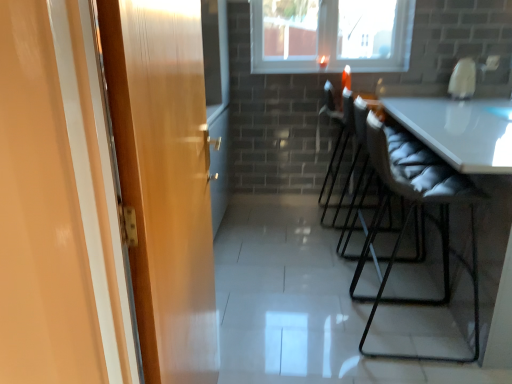
Identify the location of gray quilted cushion at right, the 1th chair positioned from the front. The height and width of the screenshot is (384, 512). (426, 215).

The height and width of the screenshot is (384, 512). Identify the location of black leather chair at center, acting as the third chair starting from the front. (344, 148).

What do you see at coordinates (344, 148) in the screenshot?
I see `black leather chair at center, acting as the 1th chair starting from the back` at bounding box center [344, 148].

You are a GUI agent. You are given a task and a screenshot of the screen. Output one action in this format:
    pyautogui.click(x=<x>, y=<y>)
    Task: Click on the wooden door at left
    The width and height of the screenshot is (512, 384).
    Given the screenshot: What is the action you would take?
    pyautogui.click(x=164, y=180)

Is wooden door at left directly adjacent to transparent glass window at upper center?

No, wooden door at left is not touching transparent glass window at upper center.

Would you say transparent glass window at upper center is part of wooden door at left's contents?

No, transparent glass window at upper center is not inside wooden door at left.

Which point is more distant from viewer, (167, 246) or (317, 32)?

Point (317, 32)

Based on their sizes in the image, would you say wooden door at left is bigger or smaller than black leather chair at center, acting as the third chair starting from the front?

Considering their sizes, wooden door at left takes up less space than black leather chair at center, acting as the third chair starting from the front.

Would you consider wooden door at left to be distant from black leather chair at center, acting as the third chair starting from the front?

wooden door at left is positioned a significant distance from black leather chair at center, acting as the third chair starting from the front.

From the image's perspective, would you say wooden door at left is positioned over black leather chair at center, acting as the third chair starting from the front?

Actually, wooden door at left appears below black leather chair at center, acting as the third chair starting from the front, in the image.

How different are the orientations of wooden door at left and black leather chair at center, acting as the third chair starting from the front, in degrees?

wooden door at left and black leather chair at center, acting as the third chair starting from the front, are facing 5.42 degrees away from each other.

Who is taller, transparent glass window at upper center or gray quilted cushion at right, the 1th chair positioned from the front?

gray quilted cushion at right, the 1th chair positioned from the front, is taller.

Can you confirm if transparent glass window at upper center is smaller than gray quilted cushion at right, which appears as the third chair when viewed from the back?

Correct, transparent glass window at upper center occupies less space than gray quilted cushion at right, which appears as the third chair when viewed from the back.

Is gray quilted cushion at right, the 1th chair positioned from the front, at the back of transparent glass window at upper center?

No, transparent glass window at upper center is not facing away from gray quilted cushion at right, the 1th chair positioned from the front.

Can we say transparent glass window at upper center lies outside gray quilted cushion at right, the 1th chair positioned from the front?

Yes.

From the image's perspective, relative to black leather chair at center, acting as the third chair starting from the front, is gray quilted cushion at right, which appears as the third chair when viewed from the back, above or below?

gray quilted cushion at right, which appears as the third chair when viewed from the back, is below black leather chair at center, acting as the third chair starting from the front.

From a real-world perspective, is gray quilted cushion at right, which appears as the third chair when viewed from the back, above or below black leather chair at center, acting as the third chair starting from the front?

gray quilted cushion at right, which appears as the third chair when viewed from the back, is below black leather chair at center, acting as the third chair starting from the front.

Is gray quilted cushion at right, which appears as the third chair when viewed from the back, taller than black leather chair at center, acting as the third chair starting from the front?

Yes.

Based on their sizes in the image, would you say transparent glass window at upper center is bigger or smaller than matte gray chair at center right, positioned as the 2th chair in back-to-front order?

Clearly, transparent glass window at upper center is smaller in size than matte gray chair at center right, positioned as the 2th chair in back-to-front order.

Looking at this image, how different are the orientations of transparent glass window at upper center and matte gray chair at center right, the second chair when ordered from front to back, in degrees?

The angle between the facing direction of transparent glass window at upper center and the facing direction of matte gray chair at center right, the second chair when ordered from front to back, is 90 degrees.

Does point (355, 64) come behind point (362, 99)?

Yes, it is.

Visually, is transparent glass window at upper center positioned to the left or to the right of matte gray chair at center right, positioned as the 2th chair in back-to-front order?

From the image, it's evident that transparent glass window at upper center is to the left of matte gray chair at center right, positioned as the 2th chair in back-to-front order.

From the image's perspective, is gray quilted cushion at right, which appears as the third chair when viewed from the back, on top of transparent glass window at upper center?

No, from the image's perspective, gray quilted cushion at right, which appears as the third chair when viewed from the back, is not on top of transparent glass window at upper center.

Who is shorter, gray quilted cushion at right, which appears as the third chair when viewed from the back, or transparent glass window at upper center?

transparent glass window at upper center is shorter.

Which is behind, gray quilted cushion at right, which appears as the third chair when viewed from the back, or transparent glass window at upper center?

transparent glass window at upper center is more distant.

Consider the image. Is matte gray chair at center right, positioned as the 2th chair in back-to-front order, closer to camera compared to wooden door at left?

No, matte gray chair at center right, positioned as the 2th chair in back-to-front order, is further to the viewer.

Consider the image. From the image's perspective, is matte gray chair at center right, the second chair when ordered from front to back, located above wooden door at left?

Correct, matte gray chair at center right, the second chair when ordered from front to back, appears higher than wooden door at left in the image.

Measure the distance from matte gray chair at center right, the second chair when ordered from front to back, to wooden door at left.

matte gray chair at center right, the second chair when ordered from front to back, is 5.06 feet away from wooden door at left.

Which of these two, matte gray chair at center right, the second chair when ordered from front to back, or wooden door at left, stands shorter?

matte gray chair at center right, the second chair when ordered from front to back.

This screenshot has width=512, height=384. Find the location of `window that is behind the wooden door at left`. window that is behind the wooden door at left is located at coordinates (330, 35).

Where is `the 1st chair positioned below the wooden door at left (from a real-world perspective)`? the 1st chair positioned below the wooden door at left (from a real-world perspective) is located at coordinates (344, 148).

When comparing their distances from gray quilted cushion at right, the 1th chair positioned from the front, does transparent glass window at upper center or wooden door at left seem further?

transparent glass window at upper center.

Which object lies further to the anchor point matte gray chair at center right, positioned as the 2th chair in back-to-front order, transparent glass window at upper center or wooden door at left?

wooden door at left is positioned further to the anchor matte gray chair at center right, positioned as the 2th chair in back-to-front order.

Considering their positions, is transparent glass window at upper center positioned further to black leather chair at center, acting as the third chair starting from the front, than matte gray chair at center right, the second chair when ordered from front to back?

transparent glass window at upper center is positioned further to the anchor black leather chair at center, acting as the third chair starting from the front.

Looking at this image, from the image, which object appears to be nearer to transparent glass window at upper center, gray quilted cushion at right, the 1th chair positioned from the front, or black leather chair at center, acting as the third chair starting from the front?

Among the two, black leather chair at center, acting as the third chair starting from the front, is located nearer to transparent glass window at upper center.

When comparing their distances from matte gray chair at center right, the second chair when ordered from front to back, does transparent glass window at upper center or black leather chair at center, acting as the 1th chair starting from the back, seem further?

Based on the image, transparent glass window at upper center appears to be further to matte gray chair at center right, the second chair when ordered from front to back.

From the image, which object appears to be nearer to wooden door at left, transparent glass window at upper center or gray quilted cushion at right, the 1th chair positioned from the front?

Based on the image, gray quilted cushion at right, the 1th chair positioned from the front, appears to be nearer to wooden door at left.

Based on the photo, based on their spatial positions, is matte gray chair at center right, the second chair when ordered from front to back, or transparent glass window at upper center further from gray quilted cushion at right, which appears as the third chair when viewed from the back?

transparent glass window at upper center is further to gray quilted cushion at right, which appears as the third chair when viewed from the back.

Considering their positions, is gray quilted cushion at right, the 1th chair positioned from the front, positioned closer to matte gray chair at center right, positioned as the 2th chair in back-to-front order, than transparent glass window at upper center?

Based on the image, gray quilted cushion at right, the 1th chair positioned from the front, appears to be nearer to matte gray chair at center right, positioned as the 2th chair in back-to-front order.

The height and width of the screenshot is (384, 512). Find the location of `chair between wooden door at left and matte gray chair at center right, positioned as the 2th chair in back-to-front order, in the front-back direction`. chair between wooden door at left and matte gray chair at center right, positioned as the 2th chair in back-to-front order, in the front-back direction is located at coordinates (426, 215).

Where is `chair between transparent glass window at upper center and matte gray chair at center right, positioned as the 2th chair in back-to-front order, vertically`? chair between transparent glass window at upper center and matte gray chair at center right, positioned as the 2th chair in back-to-front order, vertically is located at coordinates (344, 148).

At what (x,y) coordinates should I click in order to perform the action: click on chair between gray quilted cushion at right, the 1th chair positioned from the front, and black leather chair at center, acting as the 1th chair starting from the back, from front to back. Please return your answer as a coordinate pair (x, y). The image size is (512, 384). Looking at the image, I should click on (359, 183).